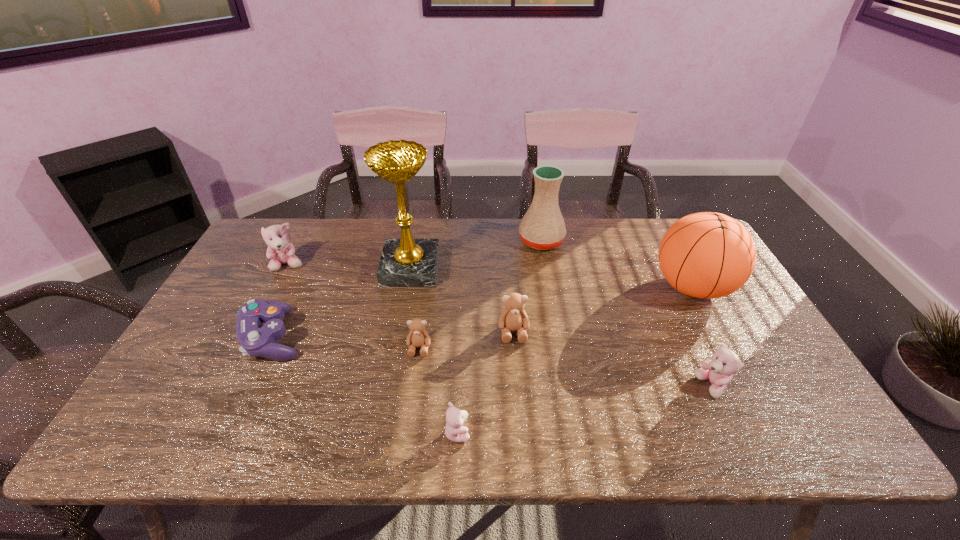
What are the coordinates of `vacant space located at the face of the rightmost teddy bear` in the screenshot? It's located at (614, 387).

Locate an element on the screen. vacant space located at the face of the rightmost teddy bear is located at coordinates (651, 387).

At what (x,y) coordinates should I click in order to perform the action: click on vacant space located 0.220m at the face of the rightmost teddy bear. Please return your answer as a coordinate pair (x, y). The image size is (960, 540). Looking at the image, I should click on (606, 387).

You are a GUI agent. You are given a task and a screenshot of the screen. Output one action in this format:
    pyautogui.click(x=<x>, y=<y>)
    Task: Click on the vacant region located 0.100m on the left of the purple control
    This screenshot has width=960, height=540.
    Given the screenshot: What is the action you would take?
    pyautogui.click(x=204, y=337)

You are a GUI agent. You are given a task and a screenshot of the screen. Output one action in this format:
    pyautogui.click(x=<x>, y=<y>)
    Task: Click on the free space located 0.140m on the face of the left brown teddy bear
    Image resolution: width=960 pixels, height=540 pixels.
    Given the screenshot: What is the action you would take?
    pyautogui.click(x=412, y=406)

The width and height of the screenshot is (960, 540). Identify the location of free region located at the face of the second pink teddy bear from left to right. (624, 432).

Where is `award positioned at the far edge`? The image size is (960, 540). award positioned at the far edge is located at coordinates (406, 262).

Where is `pottery located in the far edge section of the desktop`? This screenshot has height=540, width=960. pottery located in the far edge section of the desktop is located at coordinates (542, 227).

You are a GUI agent. You are given a task and a screenshot of the screen. Output one action in this format:
    pyautogui.click(x=<x>, y=<y>)
    Task: Click on the teddy bear located in the far edge section of the desktop
    The image size is (960, 540).
    Given the screenshot: What is the action you would take?
    pyautogui.click(x=280, y=251)

I want to click on object that is positioned at the near edge, so click(x=455, y=431).